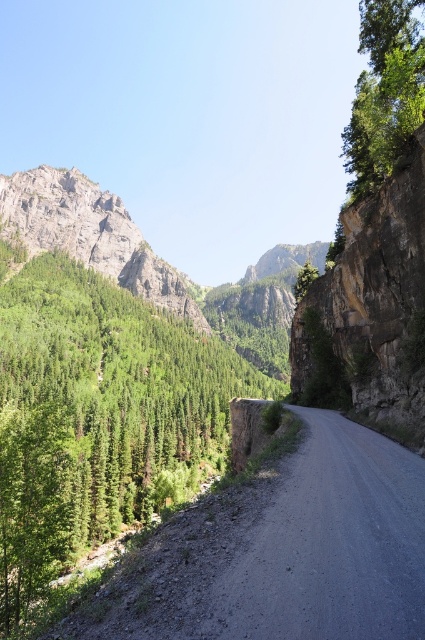
Question: Is gray gravel road at center further to camera compared to rugged granite mountain at upper left?

Choices:
 (A) no
 (B) yes

Answer: (A)

Question: Estimate the real-world distances between objects in this image. Which object is farther from the gray gravel road at center?

Choices:
 (A) rugged granite mountain at upper left
 (B) green matte tree at left

Answer: (A)

Question: Which of the following is the closest to the observer?

Choices:
 (A) (108, 492)
 (B) (356, 611)
 (C) (193, 317)

Answer: (B)

Question: Which point is farther to the camera?

Choices:
 (A) green matte tree at left
 (B) gray gravel road at center
 (C) rugged granite mountain at upper left

Answer: (C)

Question: Can you confirm if gray gravel road at center is wider than rugged granite mountain at upper left?

Choices:
 (A) yes
 (B) no

Answer: (B)

Question: Can you confirm if gray gravel road at center is wider than rugged granite mountain at upper left?

Choices:
 (A) yes
 (B) no

Answer: (B)